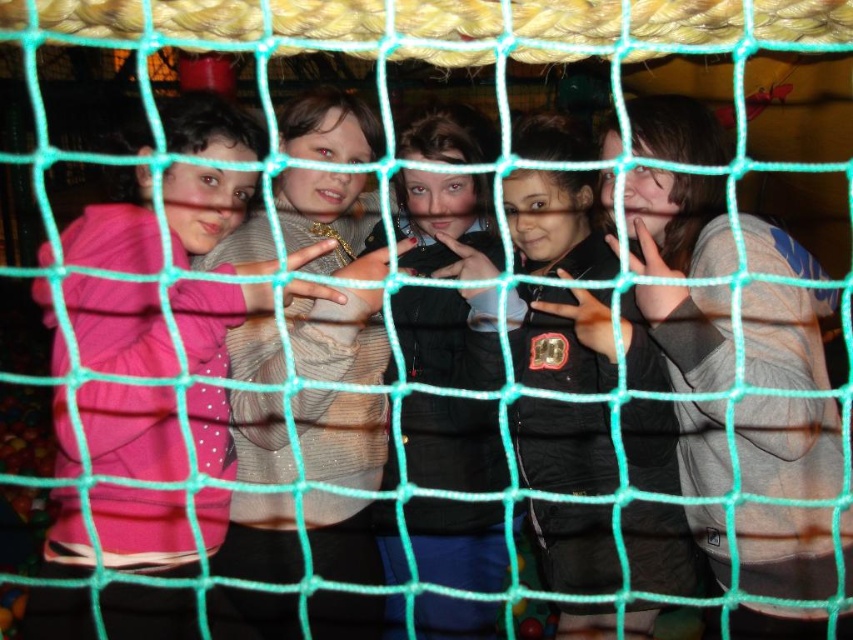
Does pink matte jacket at left come behind black leather jacket at center?

No.

This screenshot has width=853, height=640. I want to click on pink matte jacket at left, so click(x=132, y=429).

Is pink matte jacket at left bigger than dark gray jacket at center?

Correct, pink matte jacket at left is larger in size than dark gray jacket at center.

Is pink matte jacket at left positioned in front of dark gray jacket at center?

Yes, it is in front of dark gray jacket at center.

At what (x,y) coordinates should I click in order to perform the action: click on pink matte jacket at left. Please return your answer as a coordinate pair (x, y). The height and width of the screenshot is (640, 853). Looking at the image, I should click on coord(132,429).

The width and height of the screenshot is (853, 640). What are the coordinates of `pink matte jacket at left` in the screenshot? It's located at (132, 429).

Does dark gray jacket at center appear over black leather jacket at center?

Yes.

Does point (662, 412) come behind point (419, 522)?

No.

Does point (567, 483) come closer to viewer compared to point (480, 419)?

No, (567, 483) is further to viewer.

The height and width of the screenshot is (640, 853). Identify the location of dark gray jacket at center. (563, 339).